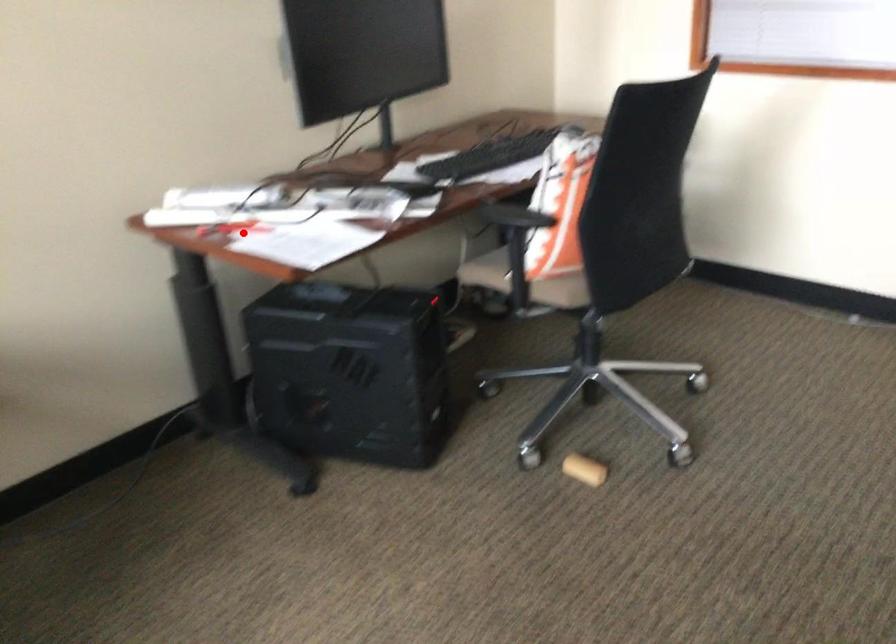
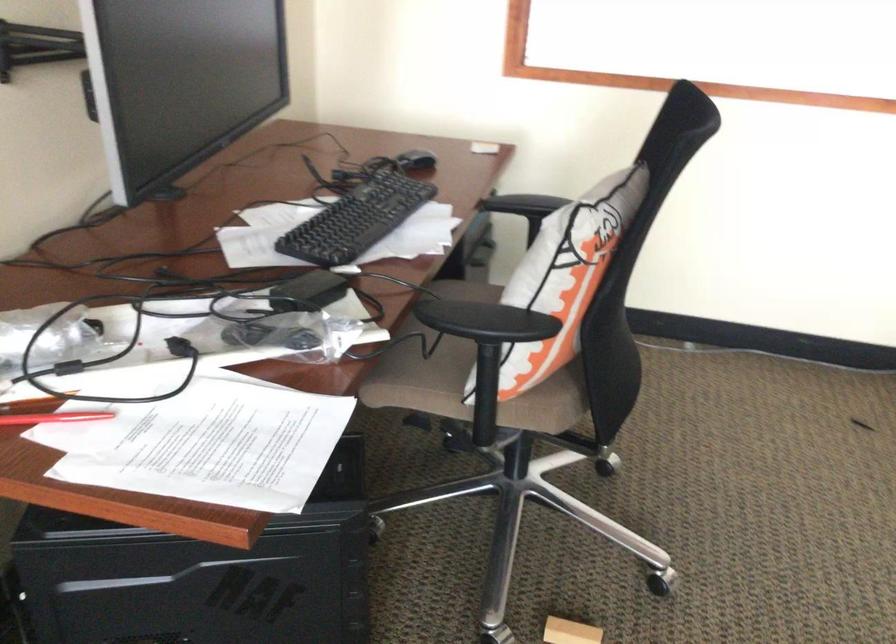
Locate, in the second image, the point that corresponds to the highlighted location in the first image.

(54, 418)